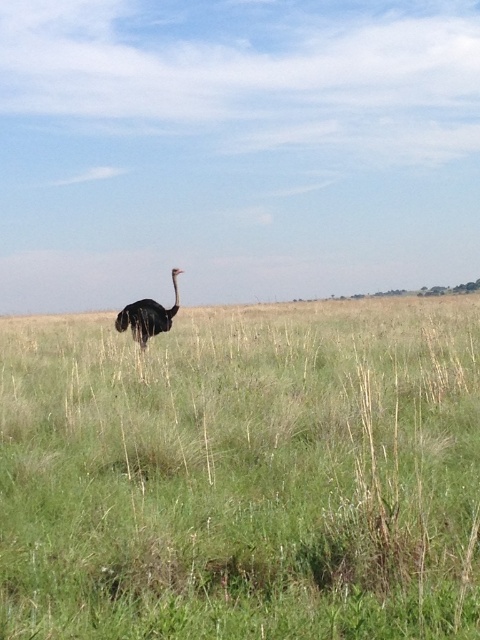
Who is lower down, green grass at center or dark brown feathers at center?

Positioned lower is green grass at center.

Does point (396, 541) come closer to viewer compared to point (122, 323)?

Yes, point (396, 541) is in front of point (122, 323).

Locate an element on the screen. The height and width of the screenshot is (640, 480). green grass at center is located at coordinates (242, 474).